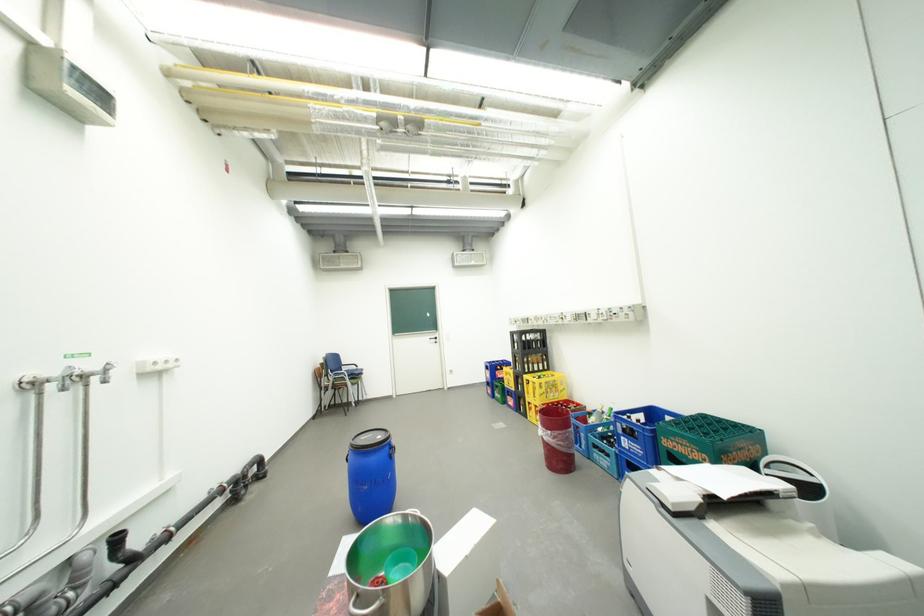
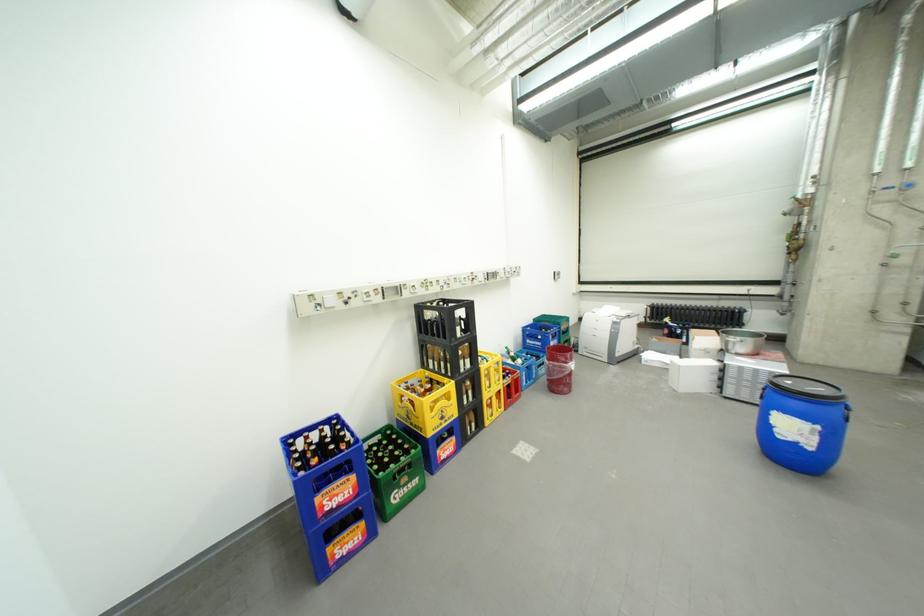
Locate, in the second image, the point that corresponds to the point at 633,439 in the first image.

(562, 344)